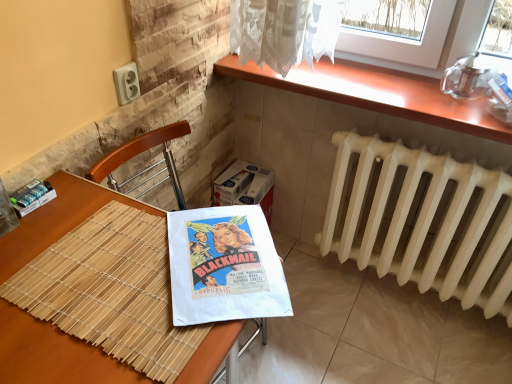
Question: Is point (37, 372) positioned closer to the camera than point (227, 200)?

Choices:
 (A) farther
 (B) closer

Answer: (B)

Question: Is wooden table at lower left wider or thinner than white cardboard box at center?

Choices:
 (A) thin
 (B) wide

Answer: (B)

Question: Which object is positioned closest to the wooden at upper right?

Choices:
 (A) white cardboard box at center
 (B) wooden table at lower left
 (C) white matte radiator at right

Answer: (C)

Question: Which is nearer to the white matte radiator at right?

Choices:
 (A) wooden at upper right
 (B) white cardboard box at center
 (C) wooden table at lower left

Answer: (A)